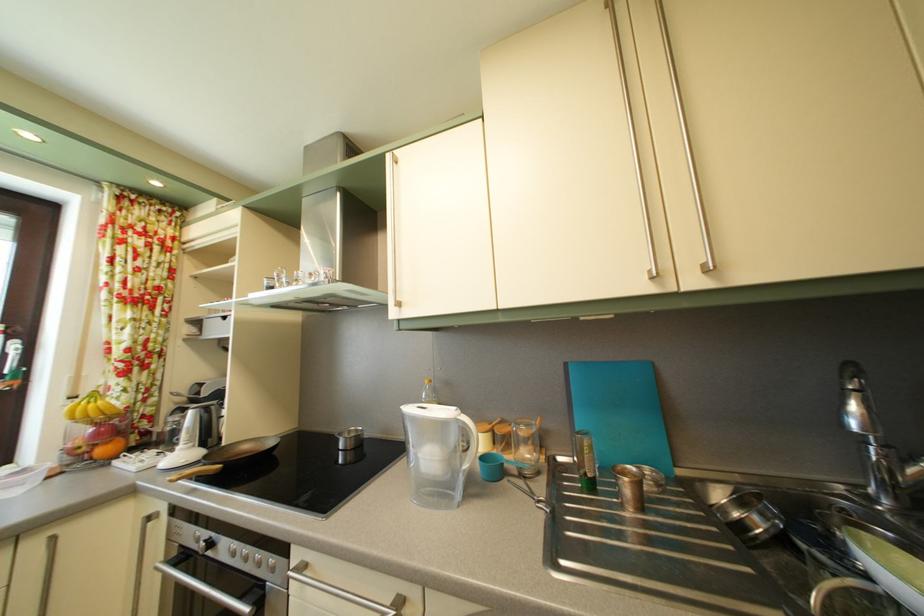
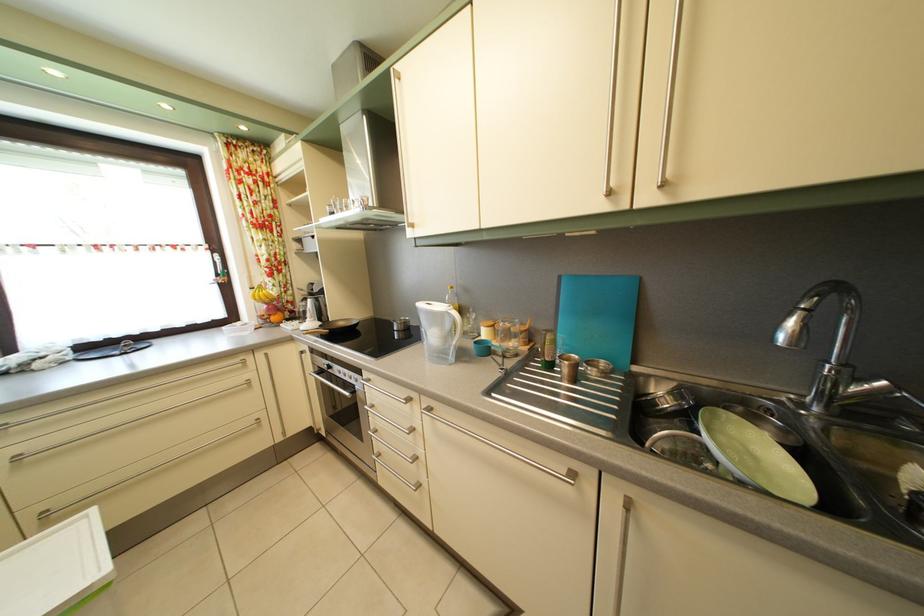
Where in the second image is the point corresponding to (219,552) from the first image?

(337, 374)